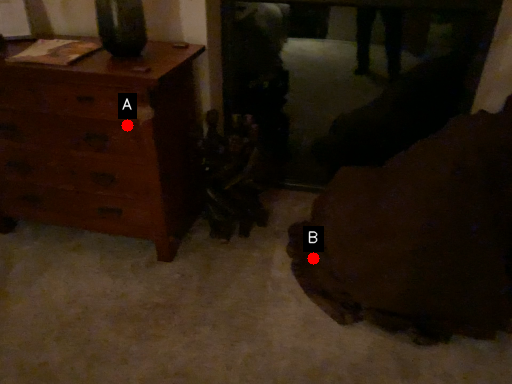
Question: Two points are circled on the image, labeled by A and B beside each circle. Which point is closer to the camera taking this photo?

Choices:
 (A) A is closer
 (B) B is closer

Answer: (A)